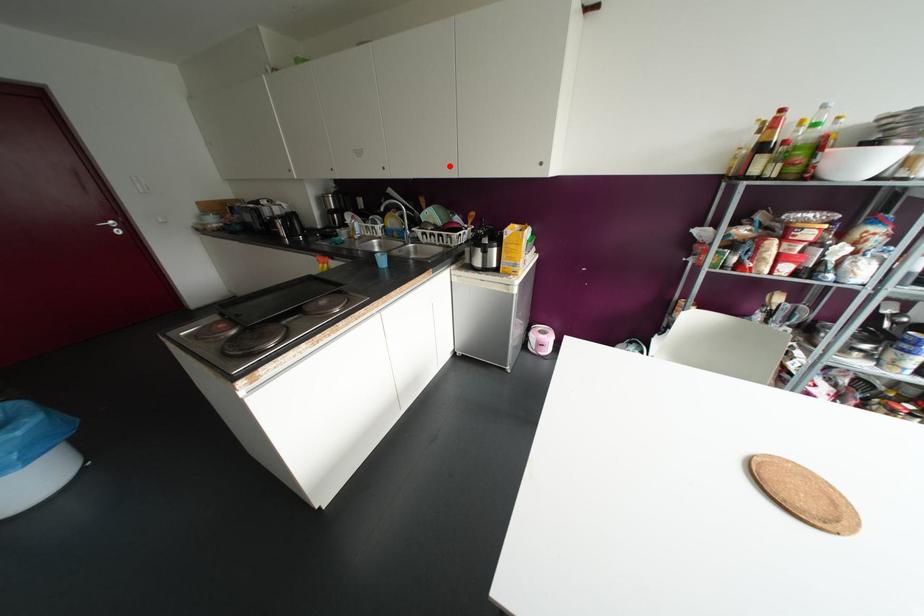
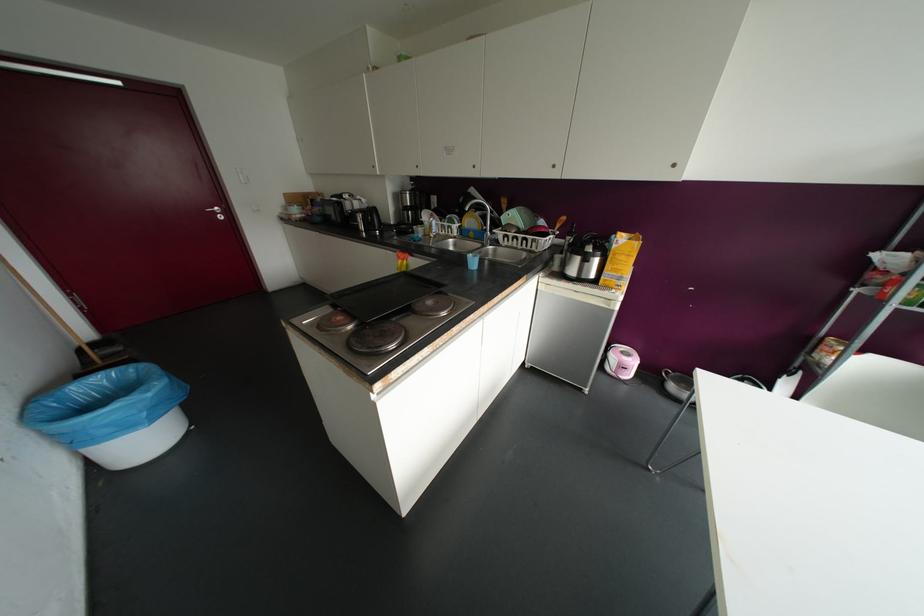
Where in the second image is the point corresponding to the highlighted location from the first image?

(553, 166)